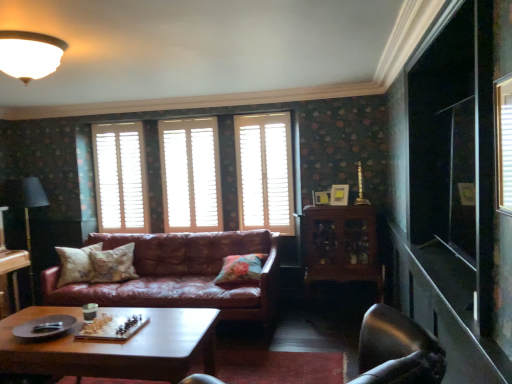
Question: From a real-world perspective, is fluffy beige pillow at center, the 2th pillow from the left, under black fabric lamp at left?

Choices:
 (A) yes
 (B) no

Answer: (A)

Question: From the image's perspective, would you say fluffy beige pillow at center, marked as the second pillow in a right-to-left arrangement, is shown under black fabric lamp at left?

Choices:
 (A) no
 (B) yes

Answer: (B)

Question: Is fluffy beige pillow at center, marked as the second pillow in a right-to-left arrangement, in front of black fabric lamp at left?

Choices:
 (A) yes
 (B) no

Answer: (A)

Question: Are fluffy beige pillow at center, the 2th pillow from the left, and black fabric lamp at left far apart?

Choices:
 (A) yes
 (B) no

Answer: (A)

Question: Is fluffy beige pillow at center, the 2th pillow from the left, turned away from black fabric lamp at left?

Choices:
 (A) yes
 (B) no

Answer: (B)

Question: Is metallic silver swivel chair at lower right spatially inside black fabric lamp at left, or outside of it?

Choices:
 (A) inside
 (B) outside

Answer: (B)

Question: Based on their sizes in the image, would you say metallic silver swivel chair at lower right is bigger or smaller than black fabric lamp at left?

Choices:
 (A) small
 (B) big

Answer: (A)

Question: From the image's perspective, is metallic silver swivel chair at lower right positioned above or below black fabric lamp at left?

Choices:
 (A) below
 (B) above

Answer: (A)

Question: Does point (422, 372) appear closer or farther from the camera than point (28, 180)?

Choices:
 (A) closer
 (B) farther

Answer: (A)

Question: From their relative heights in the image, would you say leather couch at center is taller or shorter than floral fabric pillow at center, positioned as the first pillow in right-to-left order?

Choices:
 (A) short
 (B) tall

Answer: (B)

Question: From a real-world perspective, is leather couch at center above or below floral fabric pillow at center, arranged as the 3th pillow when viewed from the left?

Choices:
 (A) above
 (B) below

Answer: (B)

Question: Based on their positions, is leather couch at center located to the left or right of floral fabric pillow at center, positioned as the first pillow in right-to-left order?

Choices:
 (A) left
 (B) right

Answer: (A)

Question: Which is correct: leather couch at center is inside floral fabric pillow at center, arranged as the 3th pillow when viewed from the left, or outside of it?

Choices:
 (A) inside
 (B) outside

Answer: (B)

Question: Considering the positions of metallic silver swivel chair at lower right and matte white picture frame at center, the first picture frame positioned from the left, in the image, is metallic silver swivel chair at lower right wider or thinner than matte white picture frame at center, the first picture frame positioned from the left,?

Choices:
 (A) wide
 (B) thin

Answer: (A)

Question: Based on their sizes in the image, would you say metallic silver swivel chair at lower right is bigger or smaller than matte white picture frame at center, positioned as the 2th picture frame in right-to-left order?

Choices:
 (A) big
 (B) small

Answer: (A)